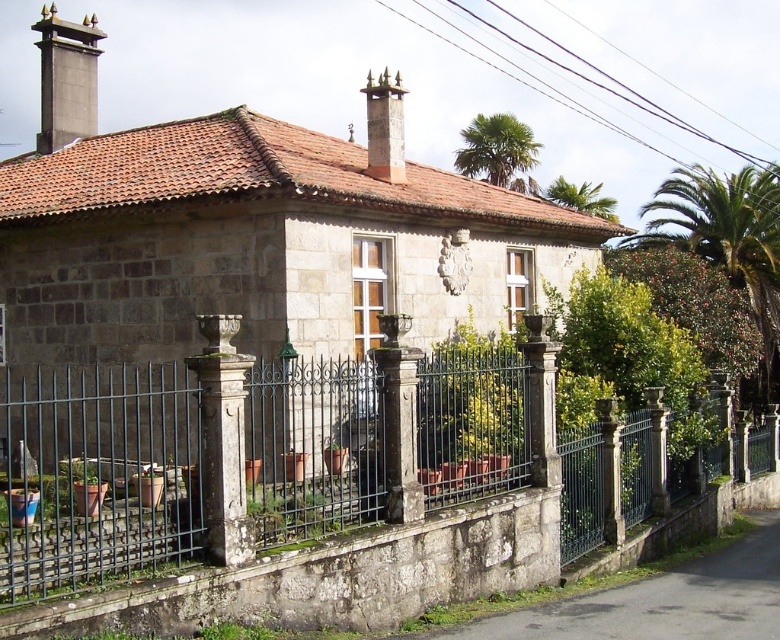
You are standing in front of the stone house and want to determine which object is taller between the smooth gray chimney at upper left and the green leafy palm tree at upper right. Based on the scene, which one is taller?

The smooth gray chimney at upper left is much taller than the green leafy palm tree at upper right.

You are standing in front of the stone house and want to know if you can see the top of the green wrought iron fence at center from behind the smooth gray chimney at upper center. Based on their heights, can you see it?

The green wrought iron fence at center has a lesser height compared to the smooth gray chimney at upper center, so yes, you can see the top of the green wrought iron fence at center from behind the smooth gray chimney at upper center because the chimney is taller and would not block the view.